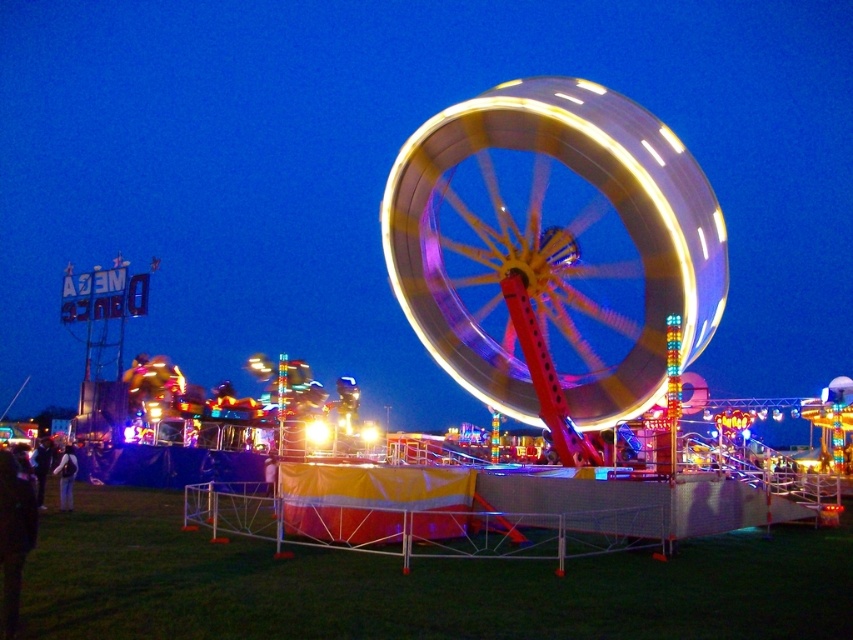
You are a visitor at the fairground and want to take a photo of the metallic yellow ferris wheel at center and the light blue jeans at lower left together in the same frame. Given that your camera has a maximum zoom range of 50 meters, will you be able to capture both objects in one shot?

The metallic yellow ferris wheel at center and light blue jeans at lower left are 60.39 meters apart from each other. Since your camera can only zoom up to 50 meters, it won t be able to capture both objects in one shot because the distance between them exceeds the maximum zoom range.

You are standing at the entrance of the fairground and see the metallic yellow ferris wheel at center represented by point (x=554, y=243). If you want to take a photo of the ferris wheel without any obstructions, which direction should you move relative to the point?

The metallic yellow ferris wheel at center is represented by point (x=554, y=243). To take a photo without obstructions, move towards the direction away from the temporary fence and other attractions in the background, ensuring the point remains centered in your view.